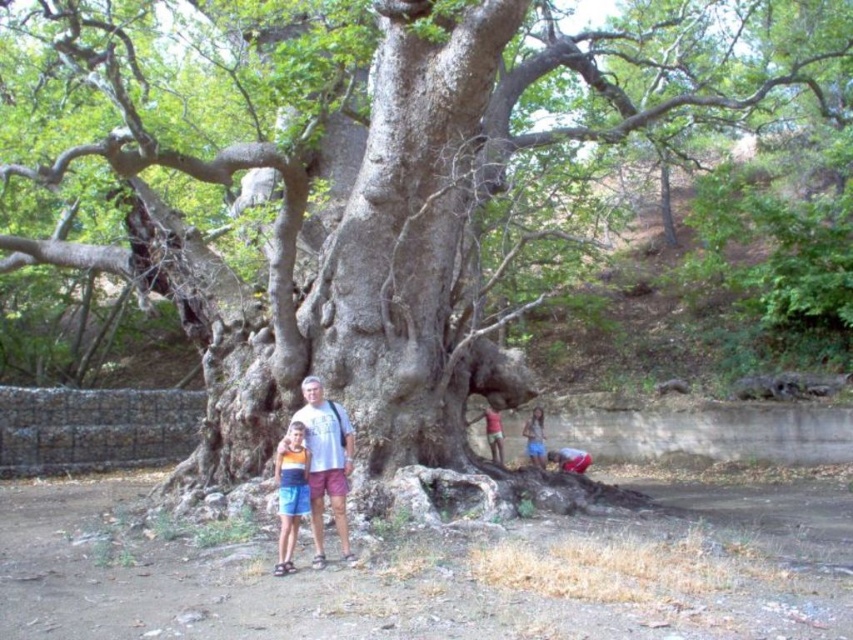
Which is above, white matte t-shirt at center or blue denim shorts at lower right?

white matte t-shirt at center is higher up.

Is white matte t-shirt at center to the right of blue denim shorts at lower right from the viewer's perspective?

In fact, white matte t-shirt at center is to the left of blue denim shorts at lower right.

Measure the distance between point (320, 484) and camera.

The distance of point (320, 484) from camera is 23.14 feet.

Find the location of a particular element. The image size is (853, 640). white matte t-shirt at center is located at coordinates (326, 461).

Between point (288, 560) and point (537, 420), which one is positioned in front?

Point (288, 560)

Can you confirm if orange fabric shorts at lower left is positioned to the right of blue denim shorts at lower right?

Incorrect, orange fabric shorts at lower left is not on the right side of blue denim shorts at lower right.

Which is behind, point (286, 444) or point (532, 442)?

The point (532, 442) is behind.

At what (x,y) coordinates should I click in order to perform the action: click on orange fabric shorts at lower left. Please return your answer as a coordinate pair (x, y). This screenshot has width=853, height=640. Looking at the image, I should click on (289, 492).

Is white matte t-shirt at center shorter than orange fabric shorts at lower left?

No, white matte t-shirt at center is not shorter than orange fabric shorts at lower left.

How much distance is there between white matte t-shirt at center and orange fabric shorts at lower left?

9.36 inches

Describe the element at coordinates (326, 461) in the screenshot. This screenshot has width=853, height=640. I see `white matte t-shirt at center` at that location.

Where is `white matte t-shirt at center`? The height and width of the screenshot is (640, 853). white matte t-shirt at center is located at coordinates (326, 461).